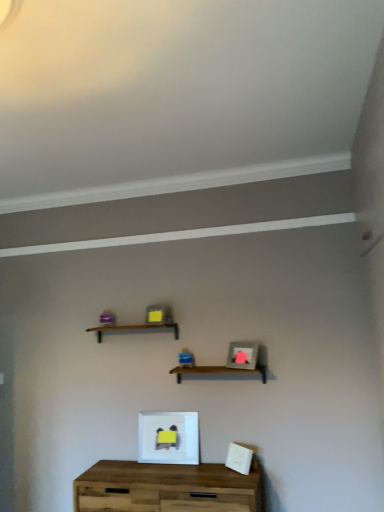
Question: Is wooden at center, which is counted as the first shelf, starting from the right, placed right next to wooden table at center?

Choices:
 (A) no
 (B) yes

Answer: (A)

Question: Is wooden at center, the 2th shelf positioned from the top, positioned with its back to wooden table at center?

Choices:
 (A) yes
 (B) no

Answer: (B)

Question: Is wooden at center, the 2th shelf positioned from the top, not near wooden table at center?

Choices:
 (A) no
 (B) yes

Answer: (A)

Question: Is wooden at center, which is counted as the first shelf, starting from the right, outside wooden table at center?

Choices:
 (A) yes
 (B) no

Answer: (A)

Question: Can you confirm if wooden at center, arranged as the first shelf when ordered from the bottom, is smaller than wooden table at center?

Choices:
 (A) yes
 (B) no

Answer: (A)

Question: From the image's perspective, is wooden at center, the 2th shelf positioned from the top, above wooden table at center?

Choices:
 (A) yes
 (B) no

Answer: (A)

Question: From the image's perspective, is matte gray picture frame at center, positioned as the first picture frame in right-to-left order, above wooden shelf at center, acting as the first shelf starting from the top?

Choices:
 (A) yes
 (B) no

Answer: (B)

Question: Is matte gray picture frame at center, which is counted as the second picture frame, starting from the left, taller than wooden shelf at center, which is the 1th shelf from left to right?

Choices:
 (A) no
 (B) yes

Answer: (B)

Question: Could you tell me if matte gray picture frame at center, positioned as the first picture frame in right-to-left order, is turned towards wooden shelf at center, acting as the first shelf starting from the top?

Choices:
 (A) no
 (B) yes

Answer: (A)

Question: Does matte gray picture frame at center, acting as the second picture frame starting from the bottom, have a lesser height compared to wooden shelf at center, positioned as the second shelf in right-to-left order?

Choices:
 (A) no
 (B) yes

Answer: (A)

Question: From a real-world perspective, is matte gray picture frame at center, which is counted as the second picture frame, starting from the left, beneath wooden shelf at center, marked as the second shelf in a bottom-to-top arrangement?

Choices:
 (A) no
 (B) yes

Answer: (B)

Question: Does matte gray picture frame at center, positioned as the first picture frame in right-to-left order, lie in front of wooden shelf at center, marked as the second shelf in a bottom-to-top arrangement?

Choices:
 (A) yes
 (B) no

Answer: (A)

Question: Is wooden table at center facing away from wooden shelf at center, positioned as the second shelf in right-to-left order?

Choices:
 (A) yes
 (B) no

Answer: (B)